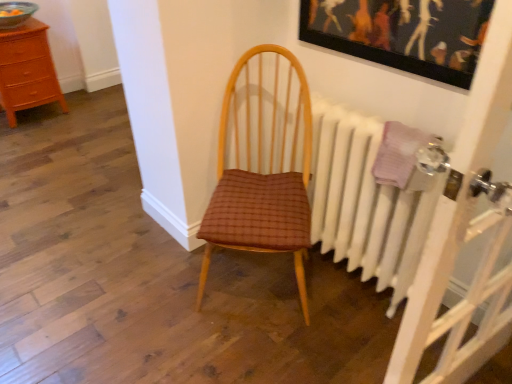
Question: In the image, is wooden chest of drawers at left positioned in front of or behind white painted radiator at right?

Choices:
 (A) behind
 (B) front

Answer: (A)

Question: From a real-world perspective, is wooden chest of drawers at left above or below white painted radiator at right?

Choices:
 (A) above
 (B) below

Answer: (B)

Question: Which object is the farthest from the brown woven fabric chair at center?

Choices:
 (A) wooden chest of drawers at left
 (B) white painted radiator at right
 (C) wooden picture frame at upper center

Answer: (A)

Question: Which object is the closest to the wooden chest of drawers at left?

Choices:
 (A) white painted radiator at right
 (B) brown woven fabric chair at center
 (C) wooden picture frame at upper center

Answer: (B)